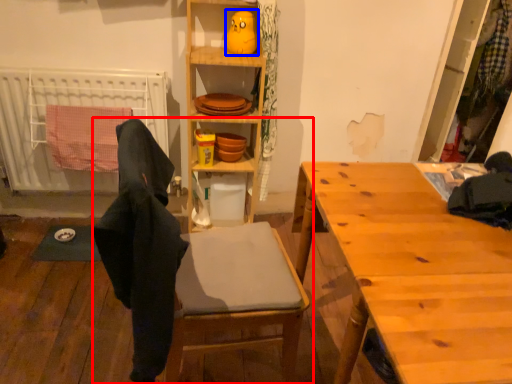
Question: Among these objects, which one is nearest to the camera, chair (highlighted by a red box) or toy (highlighted by a blue box)?

Choices:
 (A) chair
 (B) toy

Answer: (A)